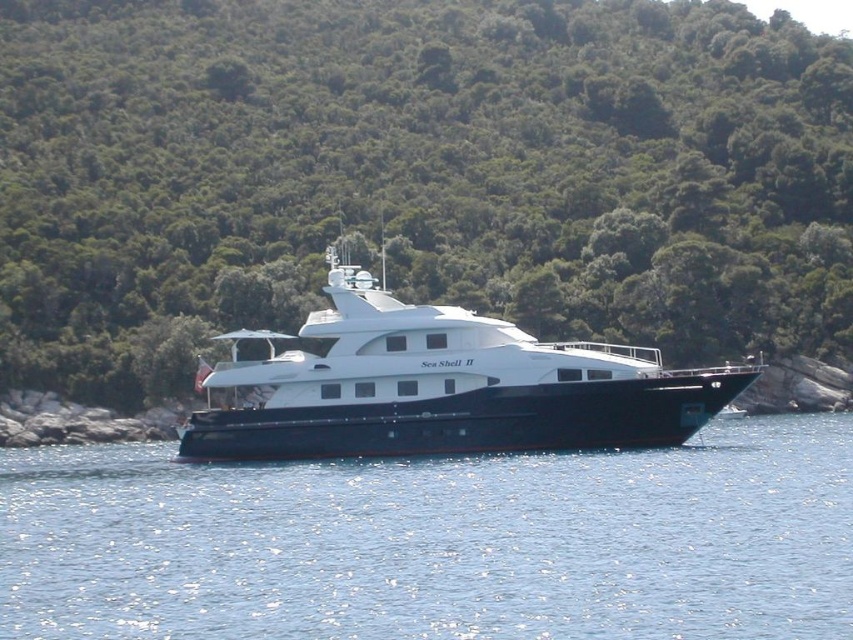
Question: Which of the following is the closest to the observer?

Choices:
 (A) (650, 204)
 (B) (590, 420)
 (C) (833, 492)

Answer: (C)

Question: Considering the real-world distances, which object is farthest from the green leafy trees at center?

Choices:
 (A) white glossy cruise ship at center
 (B) blue water at center

Answer: (B)

Question: Does green leafy trees at center lie behind white glossy cruise ship at center?

Choices:
 (A) no
 (B) yes

Answer: (B)

Question: Does blue water at center appear under white glossy cruise ship at center?

Choices:
 (A) yes
 (B) no

Answer: (A)

Question: Can you confirm if green leafy trees at center is thinner than white glossy cruise ship at center?

Choices:
 (A) no
 (B) yes

Answer: (A)

Question: Which object appears closest to the camera in this image?

Choices:
 (A) blue water at center
 (B) green leafy trees at center
 (C) white glossy cruise ship at center

Answer: (A)